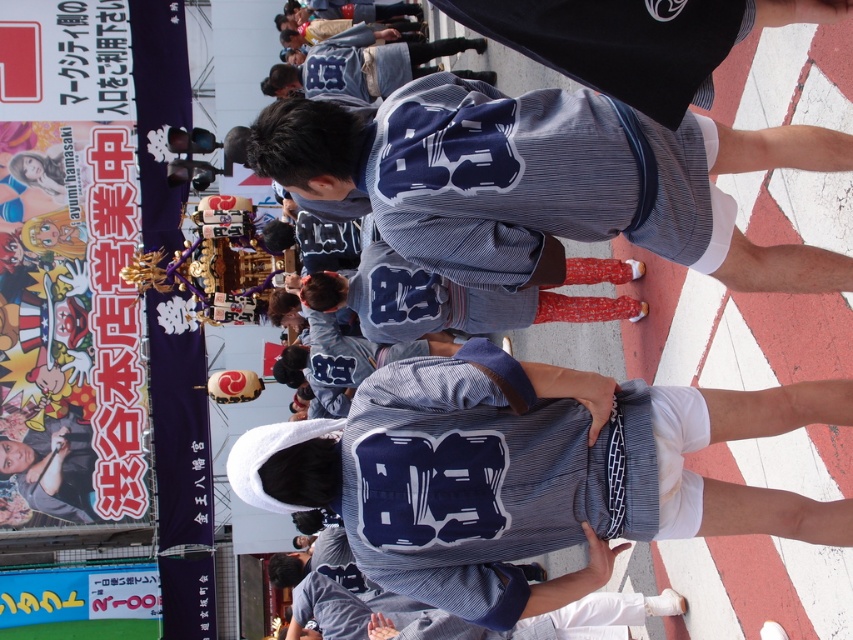
You are at the center of the event and want to find the striped fabric shirt at center. According to the coordinates provided, in which direction should you look to locate it?

The striped fabric shirt at center is located at coordinates point (x=525, y=474), so you should look towards the lower right direction from the center to find it.

You are attending this festival and want to take a photo of both the striped fabric shirt at center and the striped fabric kimono at center. Which one should you focus on first if you want to capture them from left to right in the order they appear?

The striped fabric shirt at center should be focused on first because it is positioned on the left side of the striped fabric kimono at center.

You are a photographer at the event and want to take a photo of both the striped fabric shirt at center and the striped fabric kimono at center. Which one should you focus on first to ensure both are in frame?

You should focus on the striped fabric shirt at center first since it is closer to you than the striped fabric kimono at center, ensuring both are in frame.